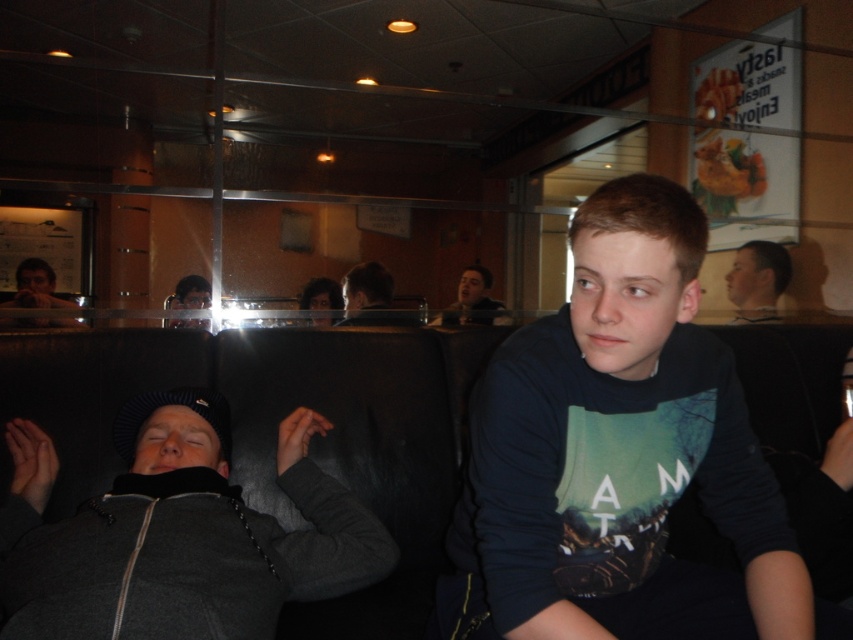
You are a delivery person who needs to place a small package between the gray fleece jacket at lower left and the matte black laptop at left. The package is 1.2 meters long. Can you fit it in the space between them?

The distance between the gray fleece jacket at lower left and the matte black laptop at left is 3.50 meters, so yes, the package can fit as it is shorter than the available space.

You are a photographer trying to capture a candid shot of the light brown hair at upper right and the matte black laptop at left. Which object would appear narrower in the photo?

The light brown hair at upper right is thinner than the matte black laptop at left, so it would appear narrower in the photo.